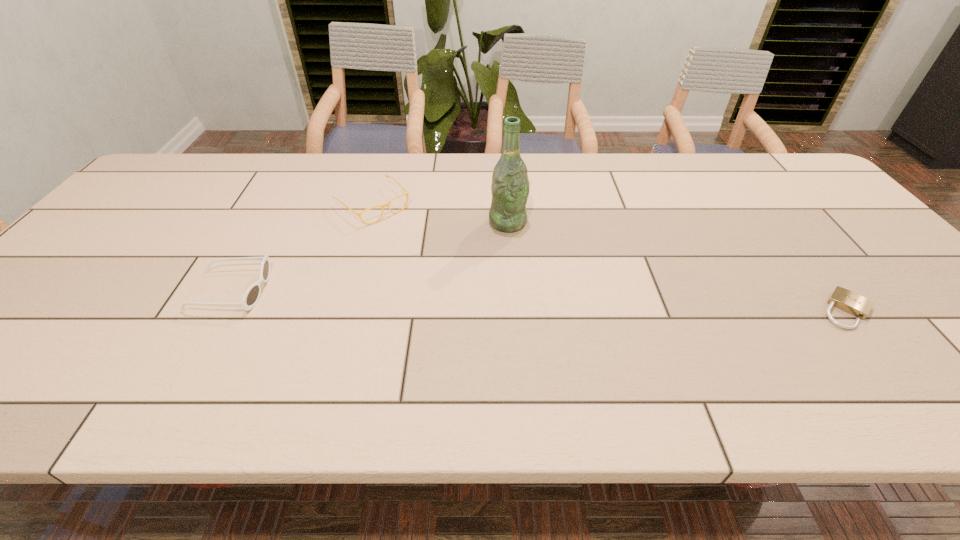
You are a GUI agent. You are given a task and a screenshot of the screen. Output one action in this format:
    pyautogui.click(x=<x>, y=<y>)
    Task: Click on the free area in between the tallest object and the sunglasses
    
    Given the screenshot: What is the action you would take?
    pyautogui.click(x=370, y=256)

Identify the location of unoccupied position between the rightmost object and the leftmost object. (539, 300).

This screenshot has width=960, height=540. What are the coordinates of `empty space between the leftmost object and the second object from left to right` in the screenshot? It's located at (301, 248).

The height and width of the screenshot is (540, 960). Identify the location of the third closest object to the beer bottle. (844, 299).

Locate an element on the screen. the third closest object to the padlock is located at coordinates (252, 294).

Where is `vacant space that satisfies the following two spatial constraints: 1. on the front side of the rightmost object; 2. on the right side of the beer bottle`? vacant space that satisfies the following two spatial constraints: 1. on the front side of the rightmost object; 2. on the right side of the beer bottle is located at coordinates (515, 310).